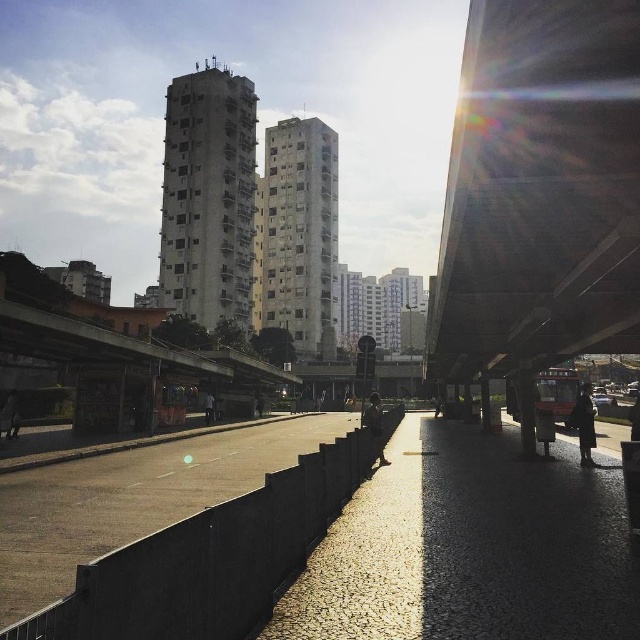
You are standing at the center of the walkway in the urban scene. You need to locate the dark brown leather coat at lower right. Which direction should you look to find it?

You should look to your lower right direction to find the dark brown leather coat at lower right since it is located at point (584, 422).

From the picture: You are a delivery person who needs to place a large package on the walkway. The package is the size of the dark brown leather coat at lower right. There is a dark brown leather jacket at center already on the walkway. Can the package be placed next to the jacket without moving it?

The dark brown leather coat at lower right is larger in size than the dark brown leather jacket at center. Since the package is the size of the coat, it would be larger than the jacket. However, the jacket is already on the walkway, so placing the package next to it may require checking if there is enough space. The answer should consider the size difference and available space on the walkway.

You are standing on the walkway and want to reach the point marked as point (10, 436). Given that your walking speed is 3 feet per second, how many seconds will it take you to reach that point?

The point (10, 436) is 63.07 feet away from the viewer. At a walking speed of 3 feet per second, it will take approximately 21 seconds to reach the point because 63.07 divided by 3 equals approximately 21 seconds.